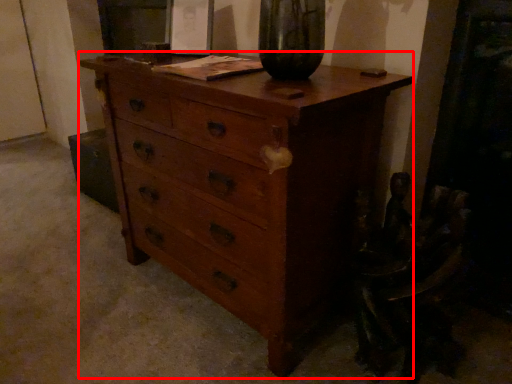
Question: From the image, what is the correct spatial relationship of chest of drawers (annotated by the red box) in relation to swivel chair?

Choices:
 (A) left
 (B) right

Answer: (A)